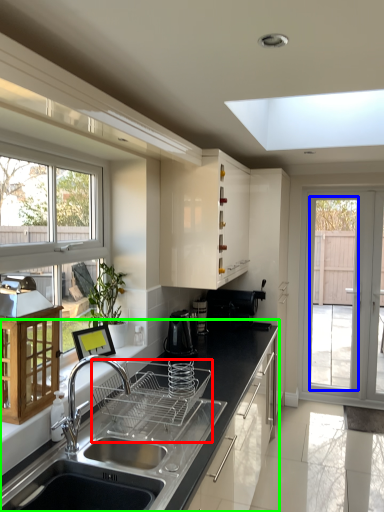
Question: Which object is the closest to the appliance (highlighted by a red box)? Choose among these: screen door (highlighted by a blue box) or countertop (highlighted by a green box).

Choices:
 (A) screen door
 (B) countertop

Answer: (B)